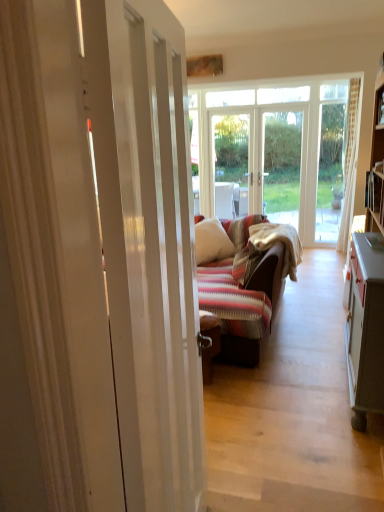
Question: Would you say white glossy door at center is to the left or to the right of white soft pillow at center in the picture?

Choices:
 (A) left
 (B) right

Answer: (A)

Question: From a real-world perspective, is white glossy door at center positioned above or below white soft pillow at center?

Choices:
 (A) above
 (B) below

Answer: (A)

Question: Is white glossy door at center inside the boundaries of white soft pillow at center, or outside?

Choices:
 (A) outside
 (B) inside

Answer: (A)

Question: From the image's perspective, relative to white glossy door at center, is white soft pillow at center above or below?

Choices:
 (A) above
 (B) below

Answer: (A)

Question: Does point (218, 231) appear closer or farther from the camera than point (165, 342)?

Choices:
 (A) closer
 (B) farther

Answer: (B)

Question: Is white soft pillow at center taller or shorter than white glossy door at center?

Choices:
 (A) short
 (B) tall

Answer: (A)

Question: Would you say white soft pillow at center is inside or outside white glossy door at center?

Choices:
 (A) outside
 (B) inside

Answer: (A)